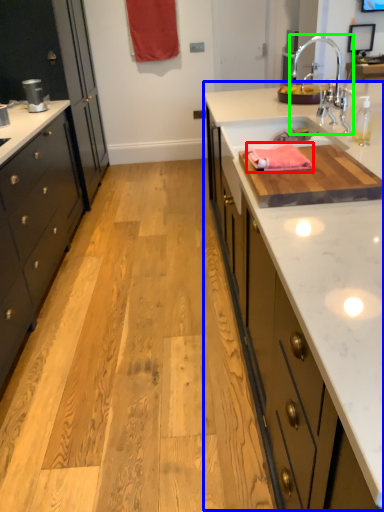
Question: Which is nearer to the material (highlighted by a red box)? countertop (highlighted by a blue box) or tap (highlighted by a green box).

Choices:
 (A) countertop
 (B) tap

Answer: (A)